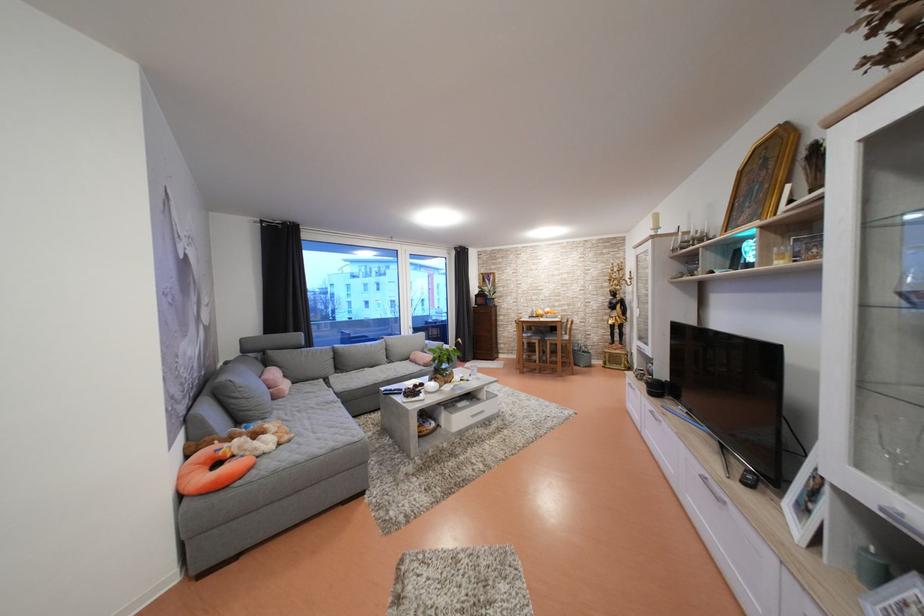
This screenshot has width=924, height=616. What are the coordinates of `white drawer pull` in the screenshot? It's located at (711, 488).